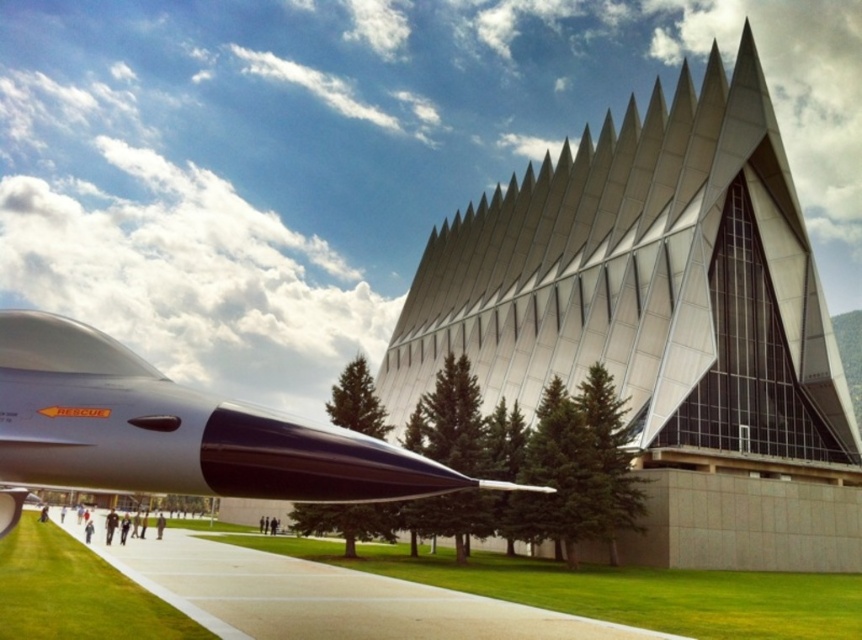
Is metallic silver building at center to the right of glossy metallic missile at lower left from the viewer's perspective?

Yes, metallic silver building at center is to the right of glossy metallic missile at lower left.

Between metallic silver building at center and glossy metallic missile at lower left, which one has more height?

metallic silver building at center

Does point (741, 520) lie behind point (161, 460)?

Yes.

Identify the location of metallic silver building at center. Image resolution: width=862 pixels, height=640 pixels. (661, 323).